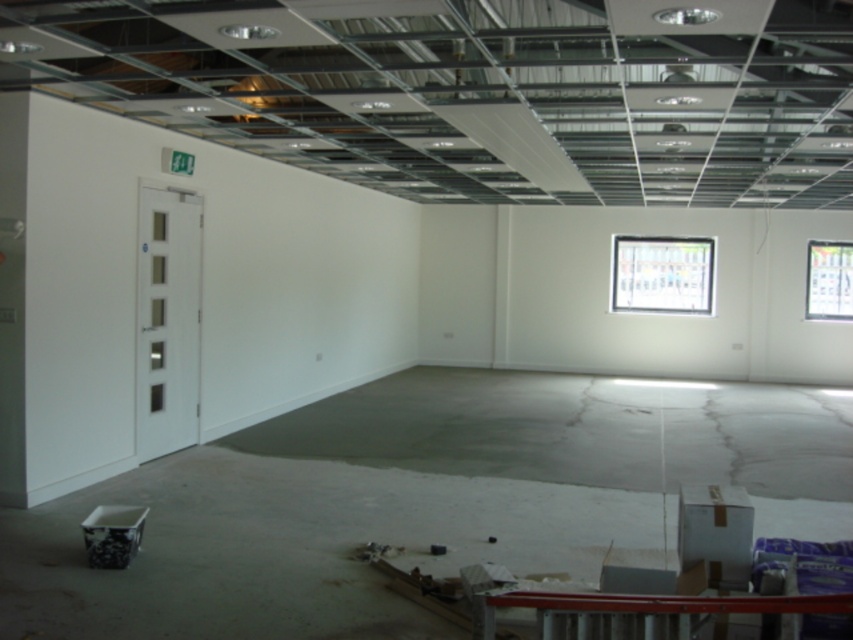
Question: Which of the following is the closest to the observer?

Choices:
 (A) (672, 308)
 (B) (811, 310)

Answer: (B)

Question: Can you confirm if transparent glass window at upper center is positioned to the left of transparent glass window at upper right?

Choices:
 (A) no
 (B) yes

Answer: (B)

Question: Considering the relative positions of transparent glass window at upper center and transparent glass window at upper right in the image provided, where is transparent glass window at upper center located with respect to transparent glass window at upper right?

Choices:
 (A) below
 (B) above

Answer: (B)

Question: Considering the relative positions of transparent glass window at upper center and transparent glass window at upper right in the image provided, where is transparent glass window at upper center located with respect to transparent glass window at upper right?

Choices:
 (A) above
 (B) below

Answer: (A)

Question: Which point is farther to the camera?

Choices:
 (A) (660, 292)
 (B) (833, 280)

Answer: (A)